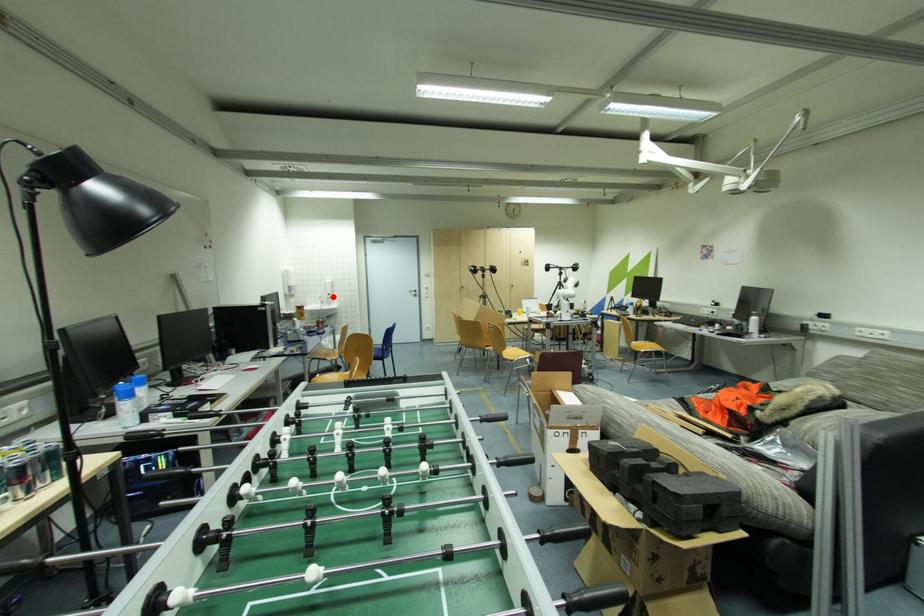
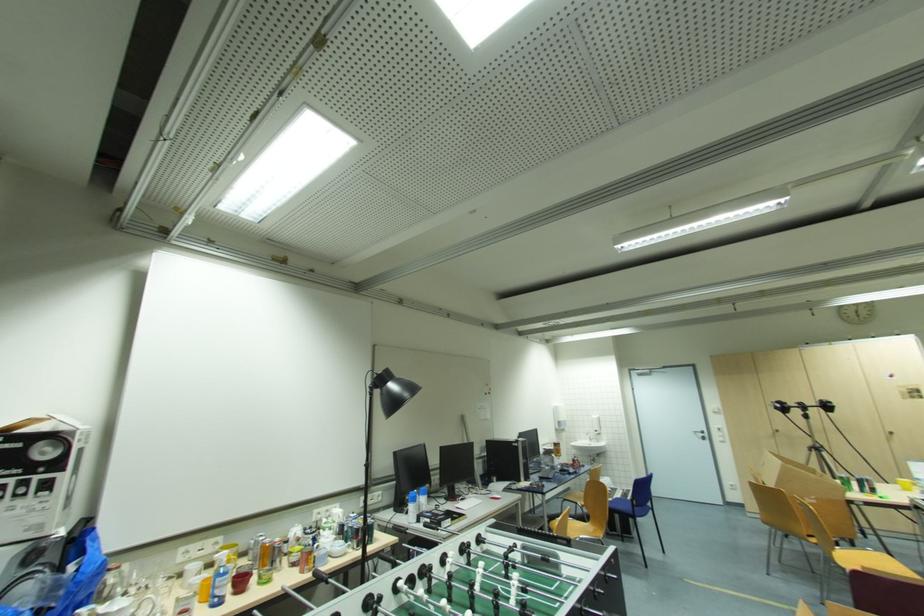
Question: I am providing you with two images of the same scene from different viewpoints. Given a red point in image1, look at the same physical point in image2. Is it:

Choices:
 (A) Closer to the viewpoint
 (B) Farther from the viewpoint

Answer: (B)